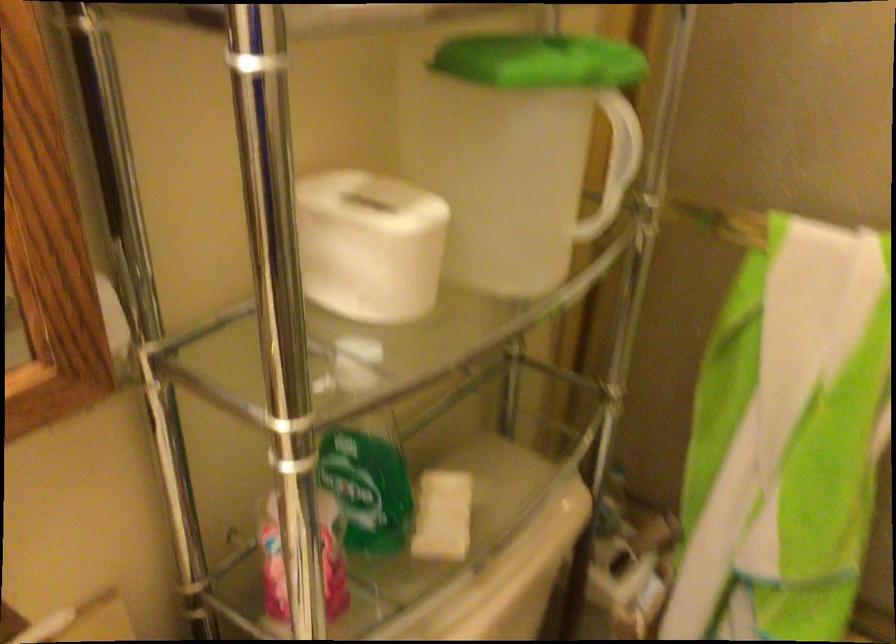
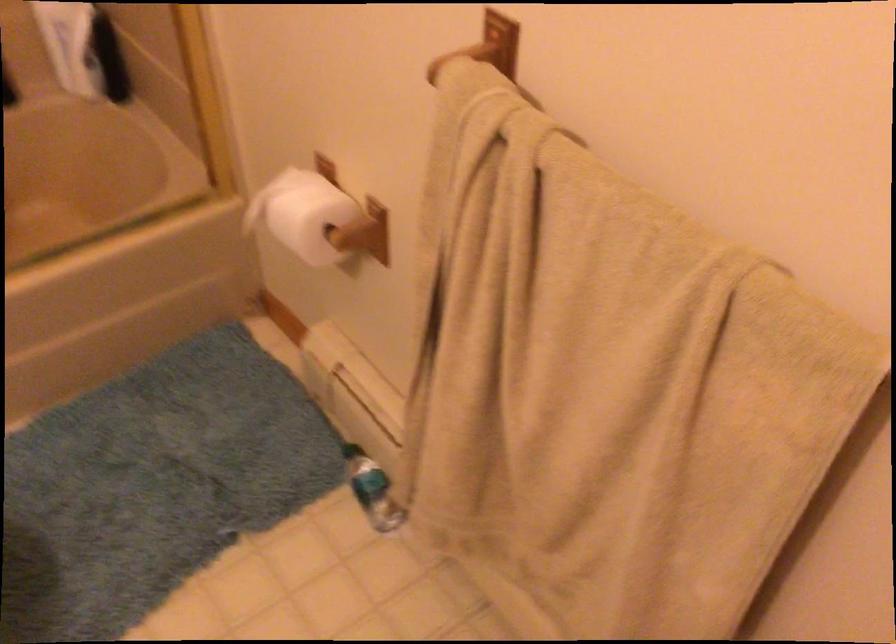
Based on the continuous images, in which direction is the camera rotating?

The camera's rotation is toward right-down.